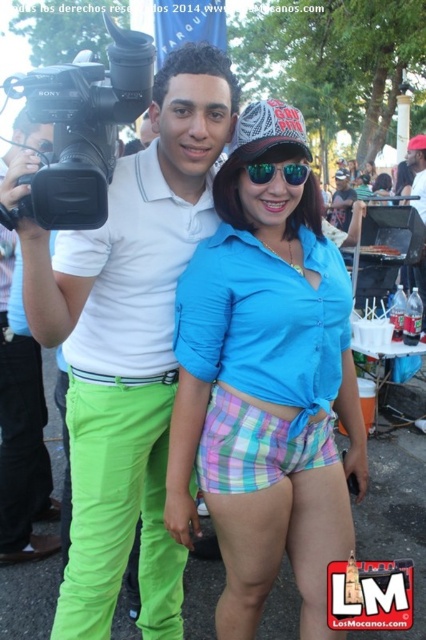
Between point (196, 372) and point (305, 172), which one is positioned behind?

Positioned behind is point (196, 372).

This screenshot has height=640, width=426. In order to click on blue cotton shirt at center in this screenshot , I will do `click(267, 376)`.

Can you confirm if matte white polo shirt at center is wider than matte white shirt at center?

No.

Does matte white polo shirt at center appear on the right side of matte white shirt at center?

No, matte white polo shirt at center is not to the right of matte white shirt at center.

Find the location of `matte white polo shirt at center`. matte white polo shirt at center is located at coordinates point(129,344).

Does point (276, 317) come farther from viewer compared to point (140, 371)?

No.

I want to click on blue cotton shirt at center, so click(267, 376).